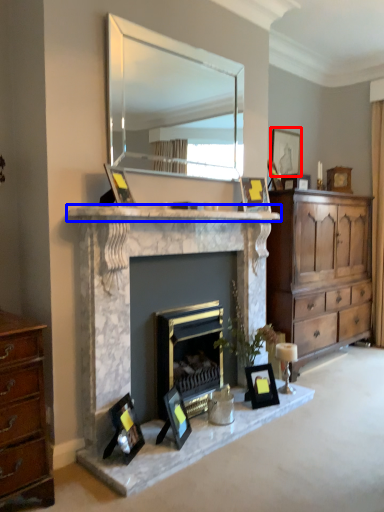
Question: Among these objects, which one is nearest to the camera, picture frame (highlighted by a red box) or mantle (highlighted by a blue box)?

Choices:
 (A) picture frame
 (B) mantle

Answer: (B)